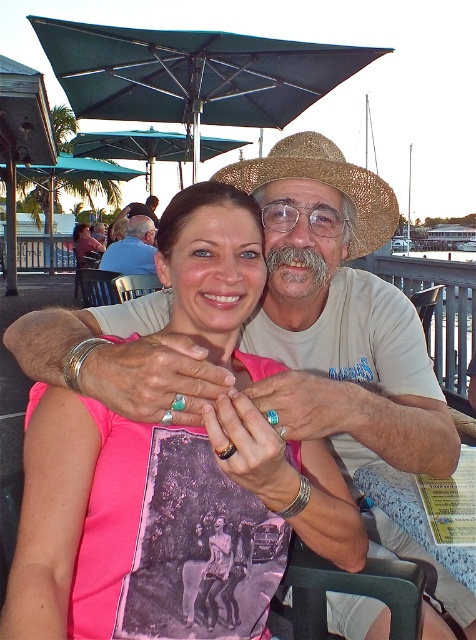
You are a photographer taking a picture of the scene. You want to ensure the pink fabric shirt at center is visible without being blocked by the teal fabric umbrella at upper center. Is this possible?

The pink fabric shirt at center is in front of the teal fabric umbrella at upper center, so it is already visible and not blocked by the umbrella.

You are a photographer trying to capture the scene. You notice a point at coordinates [134,147] in the image. Based on the scene description, can you identify what object this point is located on?

The point at coordinates [134,147] is located on the teal fabric umbrella at upper center.

You are a photographer trying to capture a candid shot of the couple without the green fabric umbrella at upper center blocking the view. Is the strawhat at center currently under the umbrella?

Yes, the green fabric umbrella at upper center is located above the strawhat at center, meaning the strawhat at center is under the umbrella and the umbrella is blocking the view.